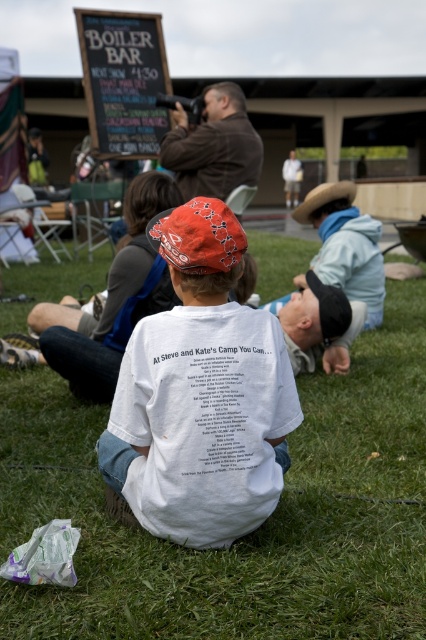
You are a photographer trying to capture a clear shot of the white cotton shirt at center. Since the green grass at center is blocking part of the shirt, can you adjust your position to avoid the grass?

The green grass at center is positioned under the white cotton shirt at center, so moving your camera angle slightly upward might help avoid the grass while still capturing the shirt.

You are a photographer trying to capture both the white cotton shirt at center and the chalkboard sign at upper left in a single shot. Since you want both to be in focus, which object should you focus on first to ensure the other remains sharp?

You should focus on the chalkboard sign at upper left first because it is farther away from the viewer than the white cotton shirt at center. By focusing on the farther object, the near object will also be in focus due to the depth of field.